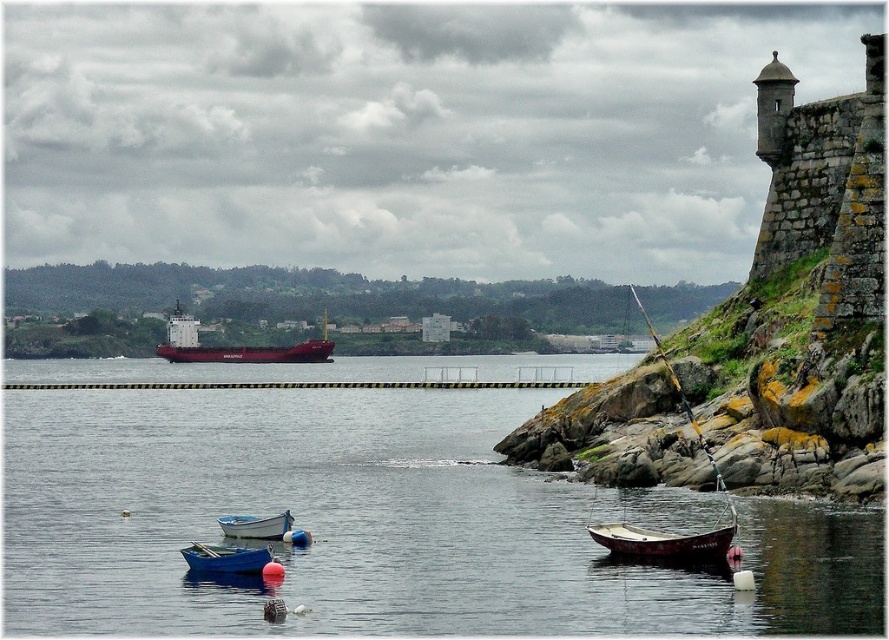
You are standing at the center of the image and want to locate the wooden boat at lower right. According to the coordinates provided, in which direction should you look to find it?

The wooden boat at lower right is located at coordinates point [667,541]. Since you are at the center, you should look towards the lower right direction to find it.